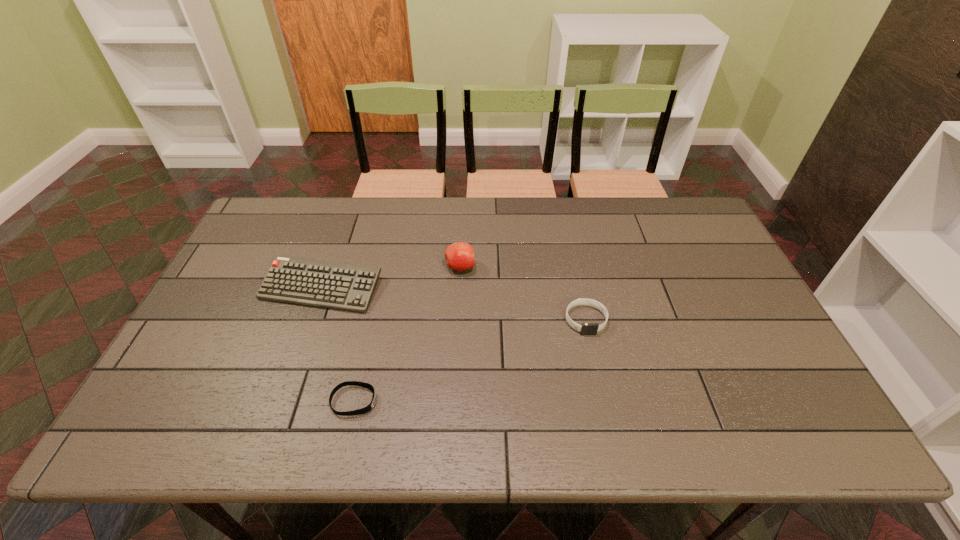
Image resolution: width=960 pixels, height=540 pixels. Identify the location of the second object from right to left. (459, 256).

I want to click on the tallest object, so click(x=459, y=256).

Image resolution: width=960 pixels, height=540 pixels. Find the location of `computer keyboard`. computer keyboard is located at coordinates (345, 286).

The width and height of the screenshot is (960, 540). Find the location of `the taller wristband`. the taller wristband is located at coordinates (586, 328).

This screenshot has height=540, width=960. Find the location of `the rightmost object`. the rightmost object is located at coordinates (586, 328).

In order to click on the nearest object in this screenshot , I will do `click(368, 408)`.

I want to click on the shortest object, so click(368, 408).

You are a GUI agent. You are given a task and a screenshot of the screen. Output one action in this format:
    pyautogui.click(x=<x>, y=<y>)
    Task: Click on the vacant position located on the left of the second object from right to left
    
    Given the screenshot: What is the action you would take?
    pyautogui.click(x=393, y=267)

This screenshot has height=540, width=960. In order to click on vacant region located on the front of the computer keyboard in this screenshot , I will do `click(279, 408)`.

At what (x,y) coordinates should I click in order to perform the action: click on vacant area located on the outer surface of the taller wristband. Please return your answer as a coordinate pair (x, y). This screenshot has width=960, height=540. Looking at the image, I should click on (592, 351).